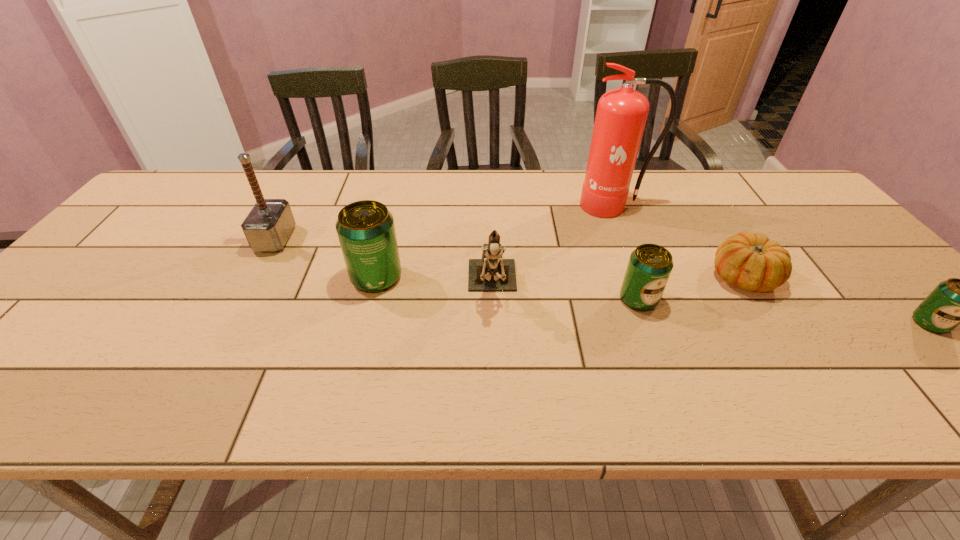
What are the coordinates of `free point that keeps the beer cans evenly spaced on the left` in the screenshot? It's located at (139, 258).